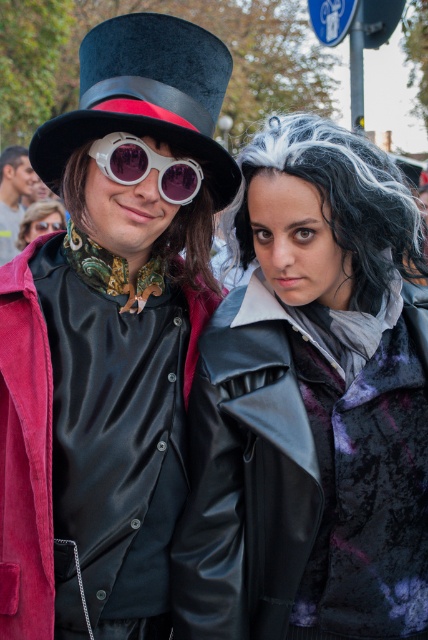
Question: Can you confirm if velvet black coat at center is wider than matte black coat at center?

Choices:
 (A) no
 (B) yes

Answer: (B)

Question: Is black velvet dress hat at upper center in front of white glossy goggles at center?

Choices:
 (A) no
 (B) yes

Answer: (B)

Question: Which point appears farthest from the camera in this image?

Choices:
 (A) (222, 496)
 (B) (383, 211)
 (C) (64, 218)
 (D) (178, 164)

Answer: (C)

Question: Which object is closer to the camera taking this photo?

Choices:
 (A) black velvet dress hat at upper center
 (B) white glossy goggles at center
 (C) gray synthetic wig at center
 (D) matte black coat at center

Answer: (A)

Question: From the image, what is the correct spatial relationship of velvet black coat at center in relation to matte black coat at center?

Choices:
 (A) left
 (B) right

Answer: (B)

Question: Which of the following is the farthest from the observer?

Choices:
 (A) (83, 179)
 (B) (64, 211)
 (C) (26, 172)

Answer: (C)